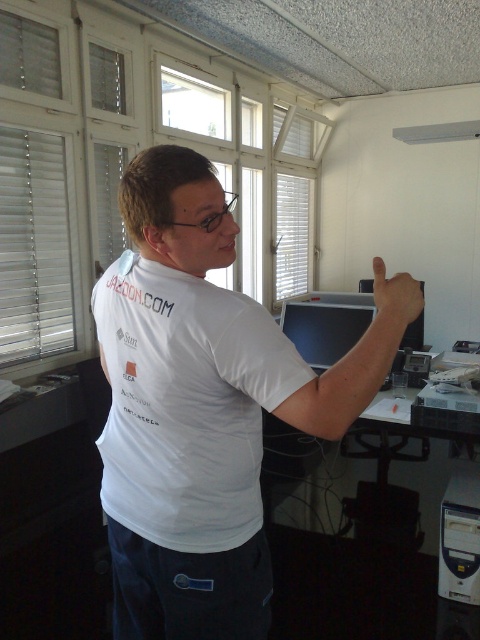
Is point (179, 202) less distant than point (177, 548)?

Yes, it is.

Is the position of white matte shirt at center less distant than that of white matte t-shirt at upper center?

Yes, white matte shirt at center is in front of white matte t-shirt at upper center.

This screenshot has width=480, height=640. What are the coordinates of `white matte shirt at center` in the screenshot? It's located at (199, 410).

Where is `white matte shirt at center`? The height and width of the screenshot is (640, 480). white matte shirt at center is located at coordinates (199, 410).

Can you confirm if white matte shirt at center is positioned to the left of matte white hand at upper right?

Indeed, white matte shirt at center is positioned on the left side of matte white hand at upper right.

Is white matte shirt at center shorter than matte white hand at upper right?

No, white matte shirt at center is not shorter than matte white hand at upper right.

This screenshot has height=640, width=480. What are the coordinates of `white matte shirt at center` in the screenshot? It's located at (199, 410).

Can you confirm if white matte t-shirt at upper center is smaller than matte white hand at upper right?

No.

Can you confirm if white matte t-shirt at upper center is positioned below matte white hand at upper right?

Yes, white matte t-shirt at upper center is below matte white hand at upper right.

Is point (132, 525) more distant than point (376, 316)?

Yes.

You are a GUI agent. You are given a task and a screenshot of the screen. Output one action in this format:
    pyautogui.click(x=<x>, y=<y>)
    Task: Click on the white matte t-shirt at upper center
    The width and height of the screenshot is (480, 640).
    Given the screenshot: What is the action you would take?
    pyautogui.click(x=187, y=403)